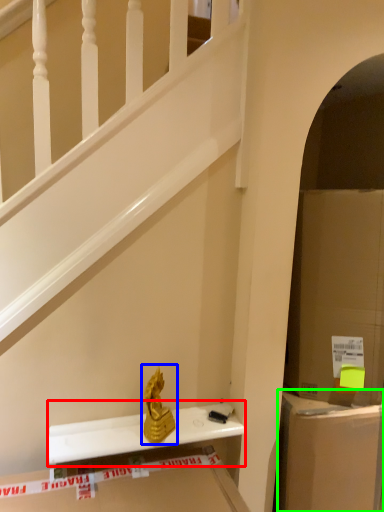
Question: Which object is the closest to the window sill (highlighted by a red box)? Choose among these: sculpture (highlighted by a blue box) or cabinet (highlighted by a green box).

Choices:
 (A) sculpture
 (B) cabinet

Answer: (A)